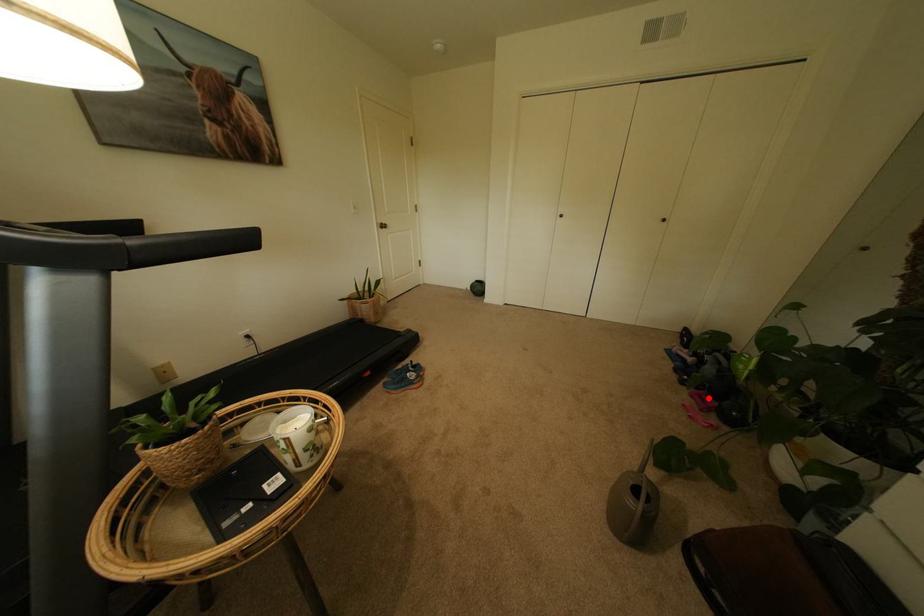
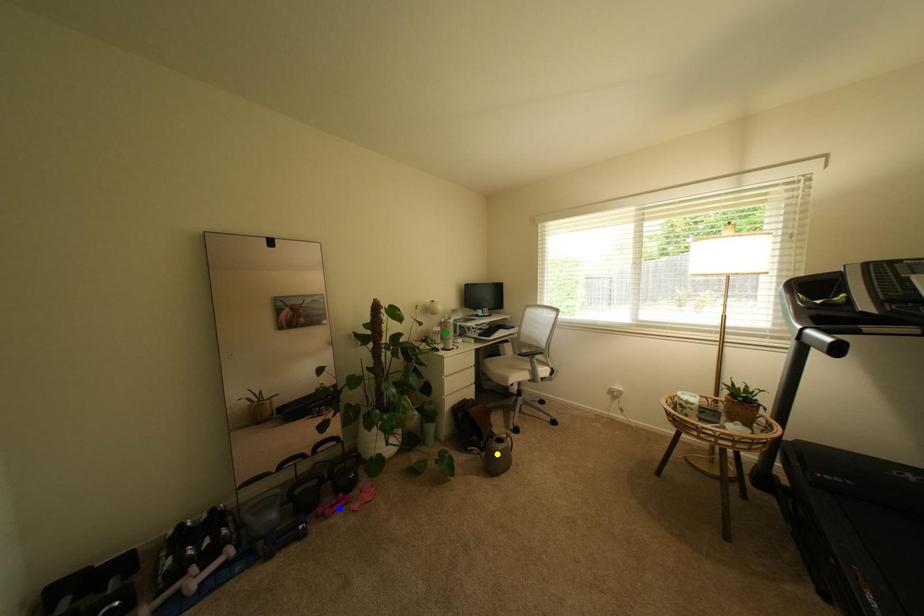
Question: I am providing you with two images of the same scene from different viewpoints. A red point is marked on the first image. You are given multiple points on the second image. Which point in image 2 is actually the same real-world point as the red point in image 1?

Choices:
 (A) green point
 (B) yellow point
 (C) blue point

Answer: (C)